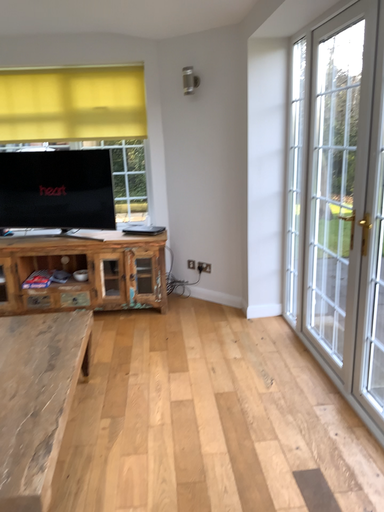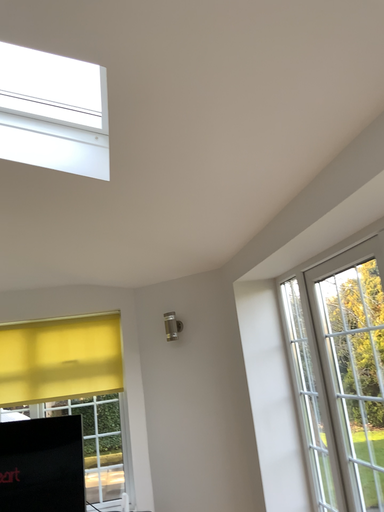
Question: How did the camera likely rotate when shooting the video?

Choices:
 (A) rotated downward
 (B) rotated upward

Answer: (B)